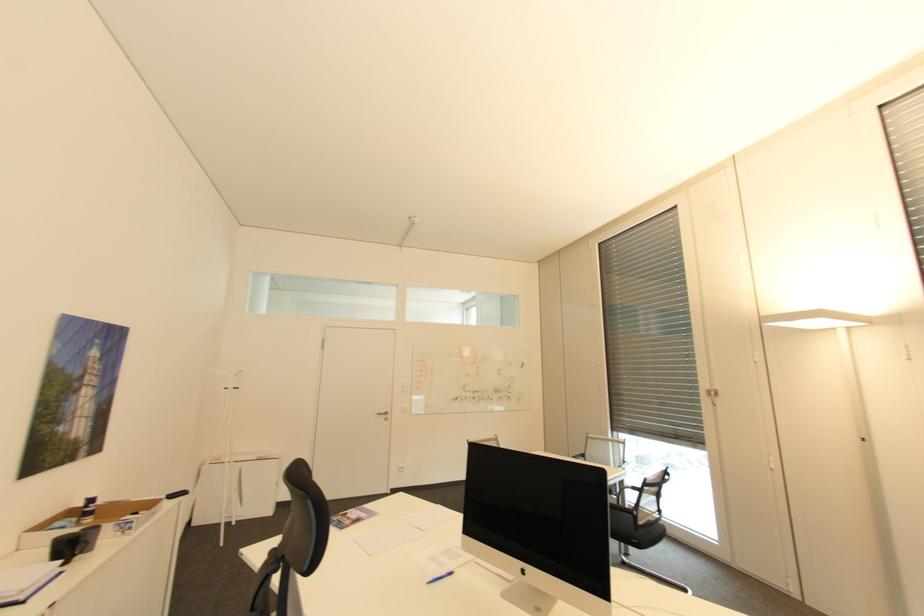
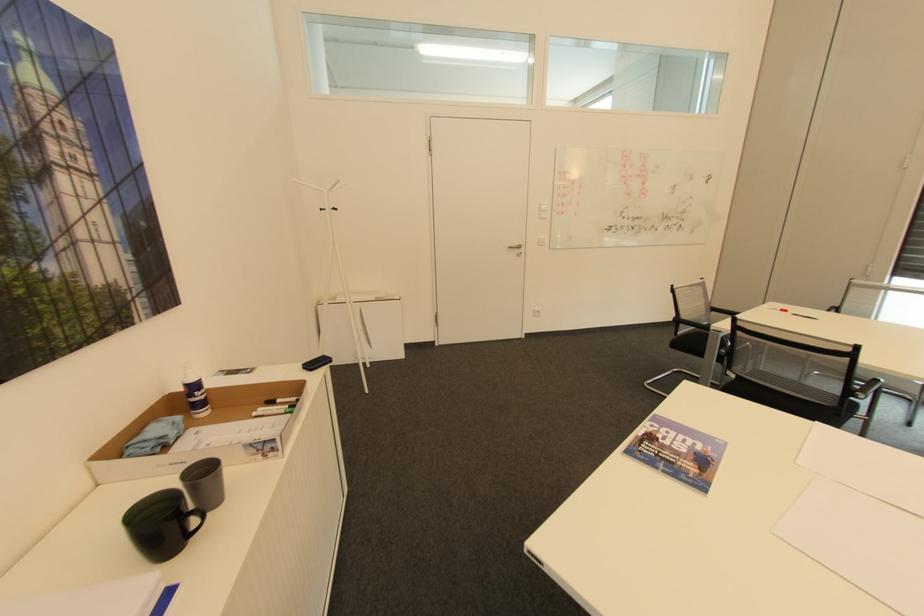
The point at [103,531] is marked in the first image. Where is the corresponding point in the second image?

(222, 477)